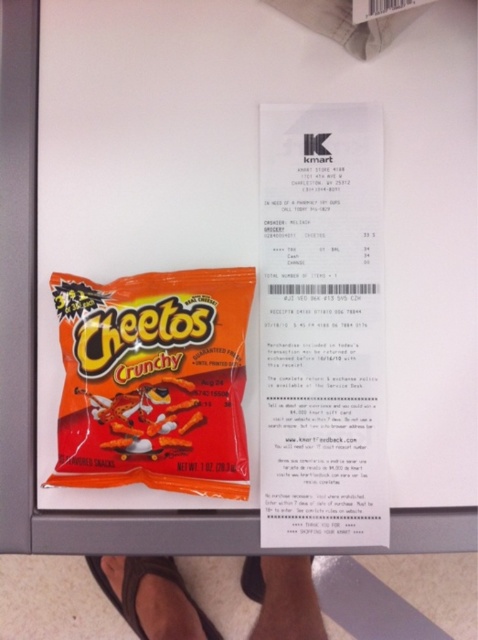
Question: Which object is farther from the camera taking this photo?

Choices:
 (A) orange matte cheetos crunchy at center
 (B) black rubber sandal at lower center
 (C) white paper receipt at center

Answer: (B)

Question: Is orange matte cheetos crunchy at center to the left of black rubber sandal at lower center from the viewer's perspective?

Choices:
 (A) no
 (B) yes

Answer: (A)

Question: Is white paper receipt at center smaller than black rubber sandal at lower center?

Choices:
 (A) no
 (B) yes

Answer: (B)

Question: Is orange matte cheetos crunchy at center further to the viewer compared to black rubber sandal at lower center?

Choices:
 (A) no
 (B) yes

Answer: (A)

Question: Which of the following is the farthest from the observer?

Choices:
 (A) black rubber sandal at lower center
 (B) orange matte cheetos crunchy at center
 (C) orange matte cheetos crunchy at left

Answer: (A)

Question: Which object appears farthest from the camera in this image?

Choices:
 (A) orange matte cheetos crunchy at center
 (B) white paper receipt at center
 (C) orange matte cheetos crunchy at left

Answer: (B)